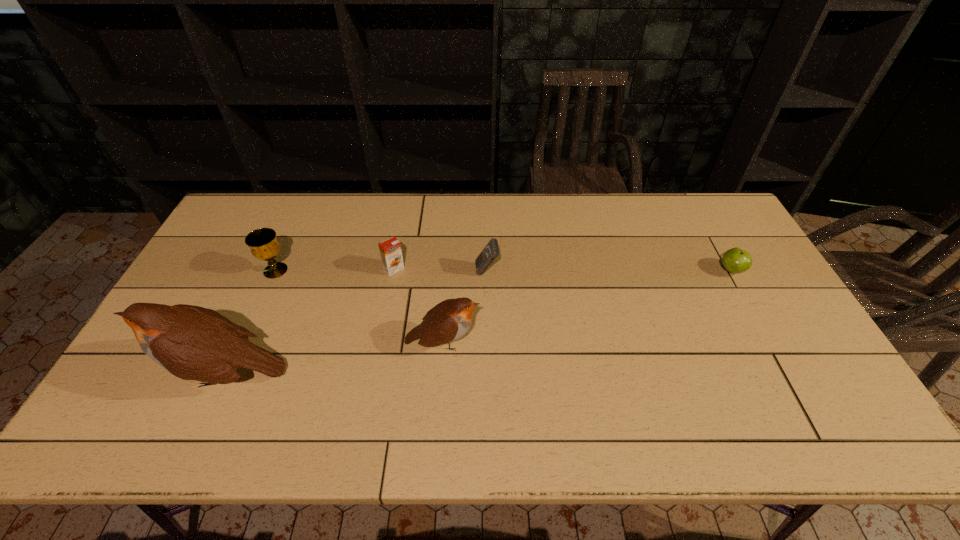
Considering the uniform spacing of birds, where should an additional bird be positioned on the right? Please locate a free spot. Please provide its 2D coordinates. Your answer should be formatted as a tuple, i.e. [(x, y)], where the tuple contains the x and y coordinates of a point satisfying the conditions above.

[(636, 315)]